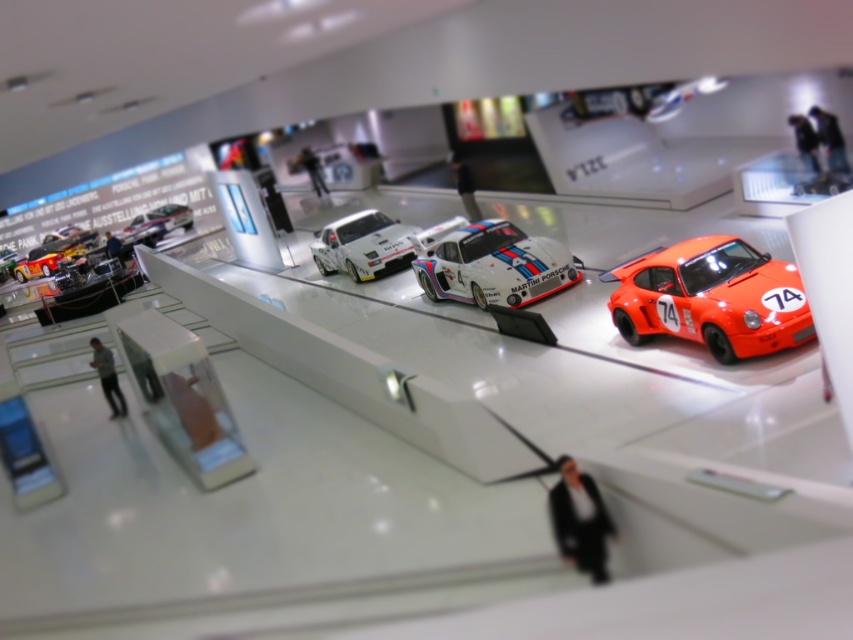
Question: Can you confirm if orange matte toy car at right is positioned to the right of white glossy toy car at center?

Choices:
 (A) no
 (B) yes

Answer: (B)

Question: Which object is closer to the camera taking this photo?

Choices:
 (A) orange matte toy car at right
 (B) metallic silver race car at upper left

Answer: (A)

Question: Which point appears farthest from the camera in this image?

Choices:
 (A) coord(512,225)
 (B) coord(189,220)
 (C) coord(314,253)
 (D) coord(795,291)

Answer: (B)

Question: Is orange matte toy car at right above white glossy toy car at center?

Choices:
 (A) no
 (B) yes

Answer: (A)

Question: Which object is positioned farthest from the orange matte toy car at right?

Choices:
 (A) white glossy race car at center
 (B) white glossy toy car at center

Answer: (B)

Question: Is white glossy race car at center thinner than metallic silver race car at upper left?

Choices:
 (A) no
 (B) yes

Answer: (A)